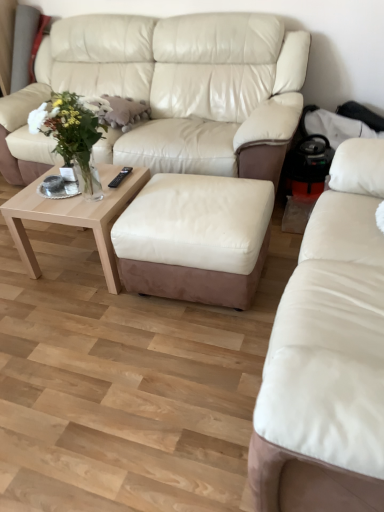
Question: Is beige leather couch at upper center, which ranks as the second studio couch in front-to-back order, to the left or to the right of translucent glass vase at center in the image?

Choices:
 (A) right
 (B) left

Answer: (A)

Question: Based on their sizes in the image, would you say beige leather couch at upper center, which ranks as the second studio couch in front-to-back order, is bigger or smaller than translucent glass vase at center?

Choices:
 (A) big
 (B) small

Answer: (A)

Question: Estimate the real-world distances between objects in this image. Which object is closer to the light wood/texture coffee table at lower center?

Choices:
 (A) translucent glass vase at center
 (B) beige leather couch at upper center, the 1th studio couch viewed from the back
 (C) leather studio couch at center, which is the 2th studio couch from back to front
 (D) white leather ottoman at center

Answer: (A)

Question: Estimate the real-world distances between objects in this image. Which object is closer to the translucent glass vase at center?

Choices:
 (A) beige leather couch at upper center, the 1th studio couch viewed from the back
 (B) leather studio couch at center, placed as the first studio couch when sorted from front to back
 (C) light wood/texture coffee table at lower center
 (D) white leather ottoman at center

Answer: (C)